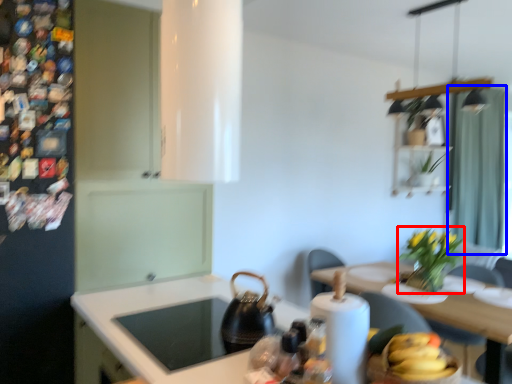
Question: Which object is further to the camera taking this photo, plant (highlighted by a red box) or curtain (highlighted by a blue box)?

Choices:
 (A) plant
 (B) curtain

Answer: (B)